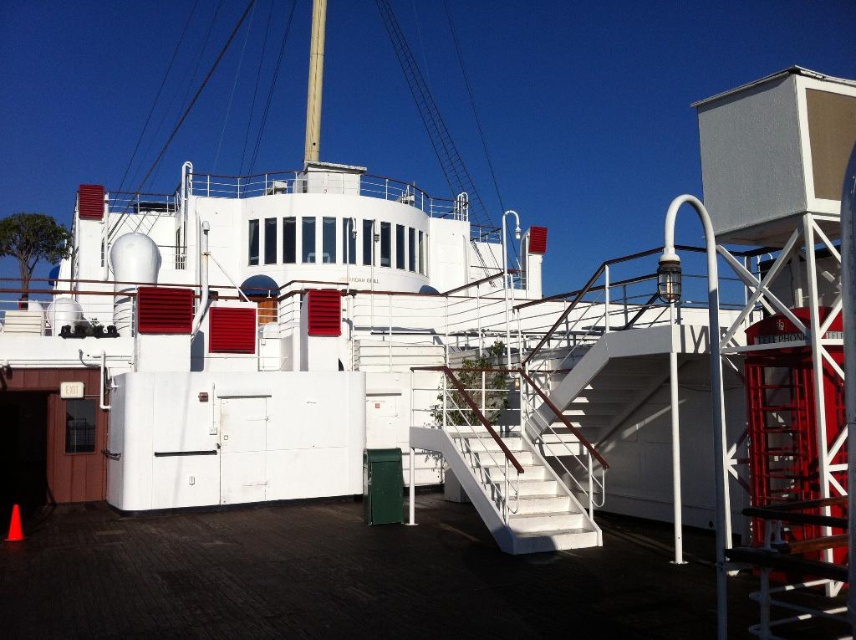
Is the position of dark brown wood at lower center less distant than that of smooth white mast at center?

Yes, it is.

Between point (224, 612) and point (316, 28), which one is positioned behind?

The point (316, 28) is behind.

Consider the image. Who is more forward, [666,604] or [312,86]?

Point [666,604] is more forward.

I want to click on dark brown wood at lower center, so click(x=337, y=579).

Can you confirm if dark brown wood at lower center is thinner than white glossy staircase at center?

In fact, dark brown wood at lower center might be wider than white glossy staircase at center.

Does point (162, 563) lie behind point (504, 548)?

No.

Which is behind, point (455, 538) or point (577, 518)?

The point (455, 538) is more distant.

Locate an element on the screen. dark brown wood at lower center is located at coordinates (337, 579).

Between white glossy staircase at center and smooth white mast at center, which one is positioned lower?

Positioned lower is white glossy staircase at center.

Is white glossy staircase at center further to the viewer compared to smooth white mast at center?

No, white glossy staircase at center is in front of smooth white mast at center.

Does point (535, 513) come behind point (316, 29)?

No, (535, 513) is in front of (316, 29).

Identify the location of white glossy staircase at center. (514, 492).